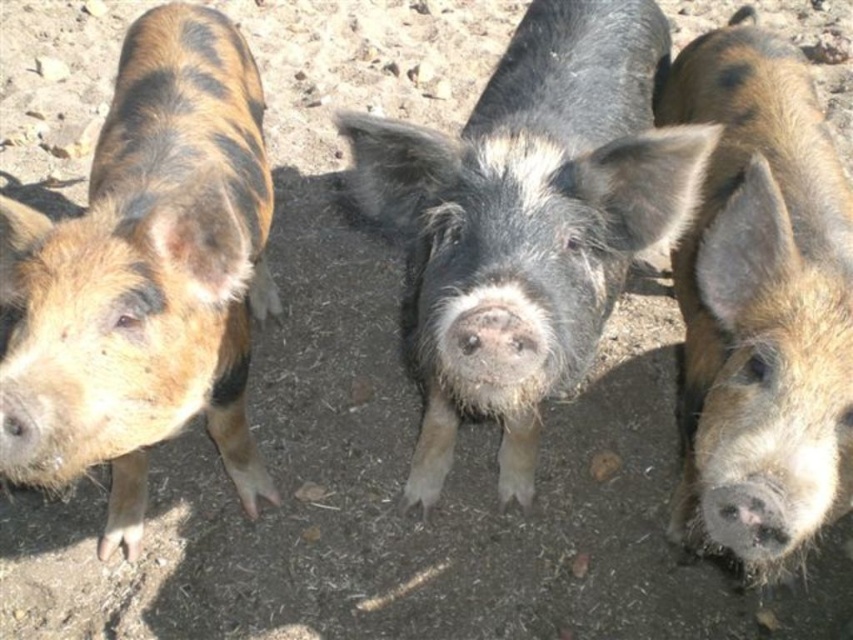
Who is higher up, brown speckled fur at left or brown speckled pig at center?

brown speckled fur at left

Who is positioned more to the left, brown speckled fur at left or brown speckled pig at center?

brown speckled fur at left is more to the left.

Where is `brown speckled fur at left`? The width and height of the screenshot is (853, 640). brown speckled fur at left is located at coordinates (144, 276).

Is black fuzzy pig at center shorter than brown speckled pig at center?

Indeed, black fuzzy pig at center has a lesser height compared to brown speckled pig at center.

What do you see at coordinates (526, 220) in the screenshot? I see `black fuzzy pig at center` at bounding box center [526, 220].

Which is in front, point (624, 259) or point (828, 381)?

Point (828, 381) is in front.

Identify the location of black fuzzy pig at center. The width and height of the screenshot is (853, 640). click(526, 220).

Is black fuzzy pig at center in front of brown speckled fur at left?

Yes, black fuzzy pig at center is closer to the viewer.

The width and height of the screenshot is (853, 640). I want to click on black fuzzy pig at center, so click(526, 220).